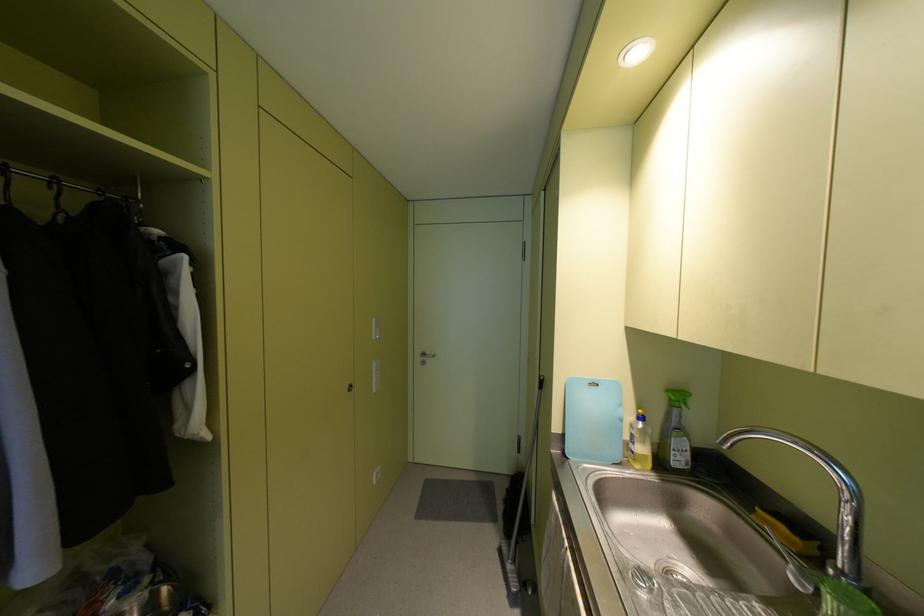
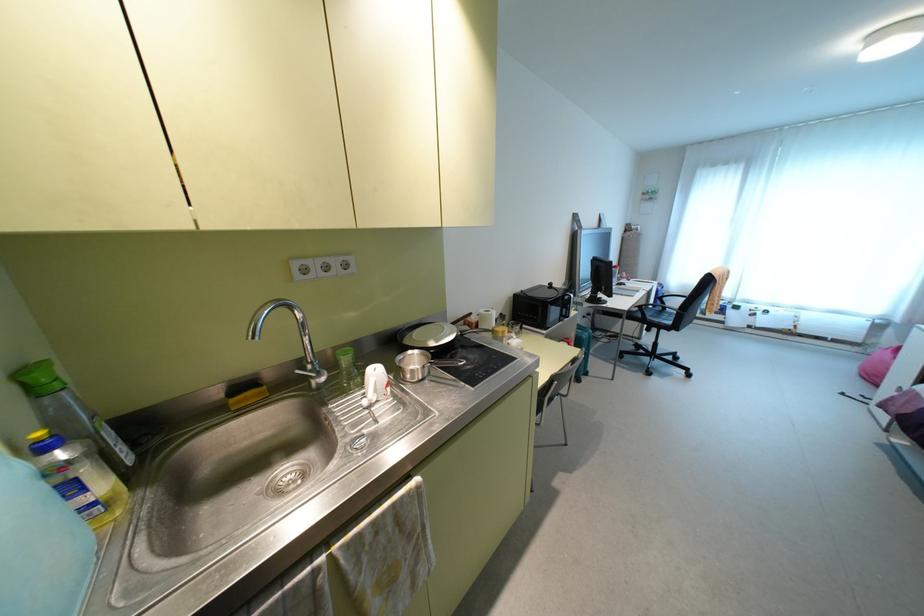
Where in the second image is the point corresponding to (640,416) from the first image?

(43, 447)